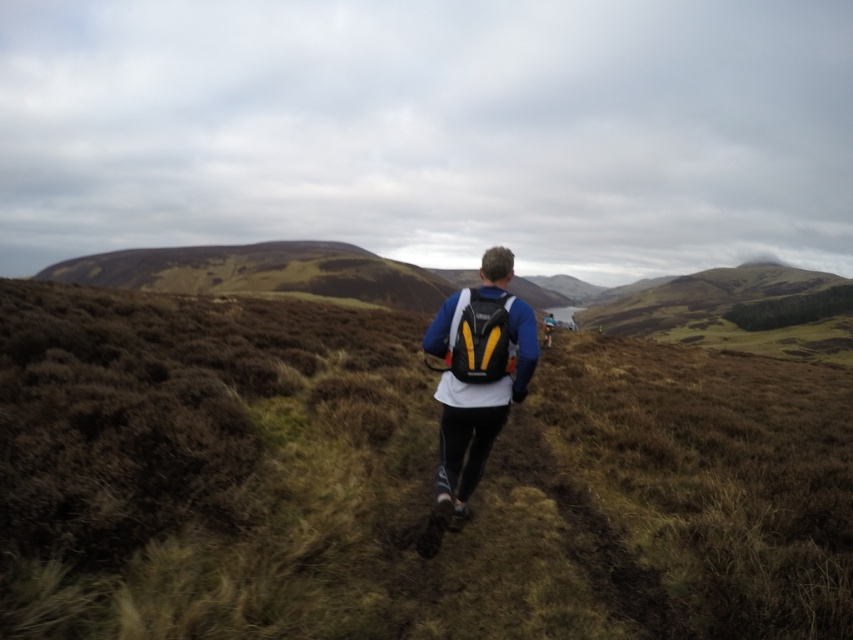
Measure the distance between point (659, 480) and camera.

They are 24.68 feet apart.

Locate an element on the screen. The image size is (853, 640). brown grassy at center is located at coordinates (401, 481).